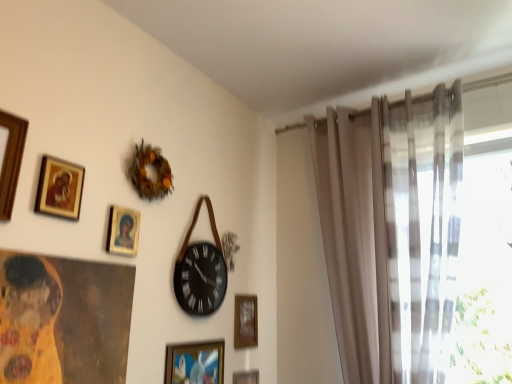
Question: From the image's perspective, is sheer beige curtain at right located beneath black leather wall clock at center?

Choices:
 (A) yes
 (B) no

Answer: (B)

Question: Is sheer beige curtain at right taller than black leather wall clock at center?

Choices:
 (A) no
 (B) yes

Answer: (B)

Question: Is sheer beige curtain at right shorter than black leather wall clock at center?

Choices:
 (A) no
 (B) yes

Answer: (A)

Question: Considering the relative sizes of sheer beige curtain at right and black leather wall clock at center in the image provided, is sheer beige curtain at right wider than black leather wall clock at center?

Choices:
 (A) no
 (B) yes

Answer: (B)

Question: Does sheer beige curtain at right have a larger size compared to black leather wall clock at center?

Choices:
 (A) yes
 (B) no

Answer: (A)

Question: Considering the relative positions of sheer beige curtain at right and black leather wall clock at center in the image provided, is sheer beige curtain at right to the right of black leather wall clock at center from the viewer's perspective?

Choices:
 (A) no
 (B) yes

Answer: (B)

Question: From the image's perspective, is metallic gold picture frame at lower center, which ranks as the second picture frame in right-to-left order, located above wooden picture frame at upper left, acting as the 1th picture frame starting from the left?

Choices:
 (A) yes
 (B) no

Answer: (B)

Question: Considering the relative sizes of metallic gold picture frame at lower center, the sixth picture frame positioned from the top, and wooden picture frame at upper left, which is the sixth picture frame in back-to-front order, in the image provided, is metallic gold picture frame at lower center, the sixth picture frame positioned from the top, bigger than wooden picture frame at upper left, which is the sixth picture frame in back-to-front order,?

Choices:
 (A) yes
 (B) no

Answer: (B)

Question: Can you confirm if metallic gold picture frame at lower center, positioned as the 1th picture frame in bottom-to-top order, is positioned to the left of wooden picture frame at upper left, the first picture frame positioned from the top?

Choices:
 (A) yes
 (B) no

Answer: (B)

Question: Is metallic gold picture frame at lower center, acting as the 2th picture frame starting from the back, oriented towards wooden picture frame at upper left, which is the sixth picture frame in back-to-front order?

Choices:
 (A) no
 (B) yes

Answer: (A)

Question: Is metallic gold picture frame at lower center, acting as the 2th picture frame starting from the back, next to wooden picture frame at upper left, acting as the 1th picture frame starting from the left?

Choices:
 (A) no
 (B) yes

Answer: (A)

Question: Can you confirm if metallic gold picture frame at lower center, the sixth picture frame positioned from the top, is taller than wooden picture frame at upper left, acting as the 1th picture frame starting from the left?

Choices:
 (A) no
 (B) yes

Answer: (A)

Question: Can you confirm if sheer beige curtain at right is smaller than metallic gold picture frame at lower center, acting as the 2th picture frame starting from the back?

Choices:
 (A) no
 (B) yes

Answer: (A)